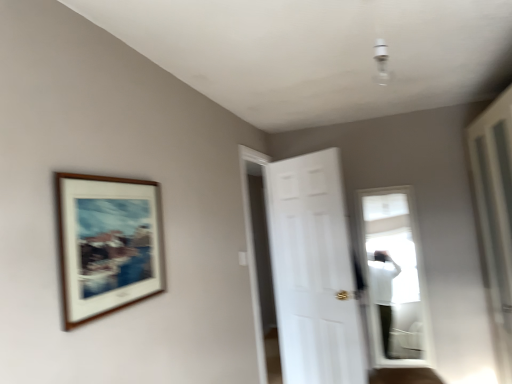
Question: Considering the relative sizes of wooden frame at upper left and white matte door at center in the image provided, is wooden frame at upper left bigger than white matte door at center?

Choices:
 (A) no
 (B) yes

Answer: (A)

Question: Does wooden frame at upper left contain white matte door at center?

Choices:
 (A) yes
 (B) no

Answer: (B)

Question: From a real-world perspective, is wooden frame at upper left on top of white matte door at center?

Choices:
 (A) no
 (B) yes

Answer: (B)

Question: Is wooden frame at upper left not near white matte door at center?

Choices:
 (A) yes
 (B) no

Answer: (A)

Question: Is wooden frame at upper left wider than white matte door at center?

Choices:
 (A) no
 (B) yes

Answer: (A)

Question: Does wooden frame at upper left have a lesser height compared to white matte door at center?

Choices:
 (A) no
 (B) yes

Answer: (B)

Question: Could wooden frame at upper left be considered to be inside white matte door at center?

Choices:
 (A) no
 (B) yes

Answer: (A)

Question: Can you confirm if white matte door at center is bigger than wooden frame at upper left?

Choices:
 (A) no
 (B) yes

Answer: (B)

Question: Is the position of white matte door at center less distant than that of wooden frame at upper left?

Choices:
 (A) no
 (B) yes

Answer: (A)

Question: From the image's perspective, does white matte door at center appear higher than wooden frame at upper left?

Choices:
 (A) yes
 (B) no

Answer: (B)

Question: Is white matte door at center further to camera compared to wooden frame at upper left?

Choices:
 (A) yes
 (B) no

Answer: (A)

Question: From a real-world perspective, is white matte door at center on top of wooden frame at upper left?

Choices:
 (A) no
 (B) yes

Answer: (A)

Question: Would you say wooden frame at upper left is inside or outside white matte door at center?

Choices:
 (A) outside
 (B) inside

Answer: (A)